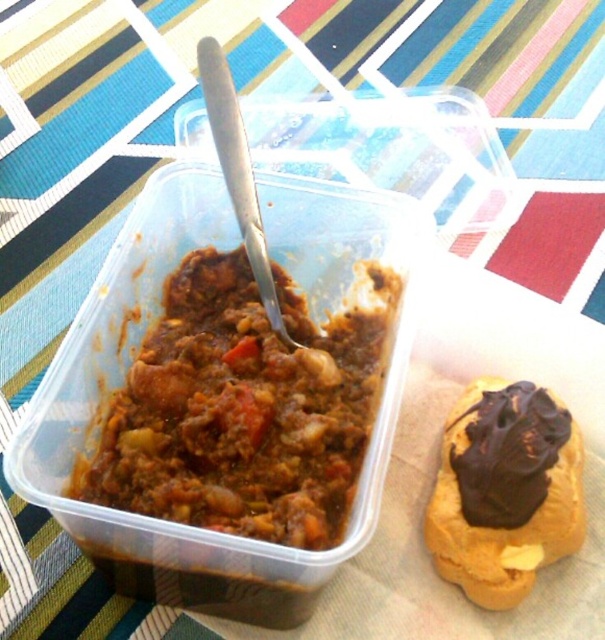
You are looking at the image of a meal on a table. There are two points marked in the scene. One is at coordinate point (191, 483) and the other is at point (563, 540). Which of these two points is closer to you?

Point (191, 483) is closer to the camera than point (563, 540).